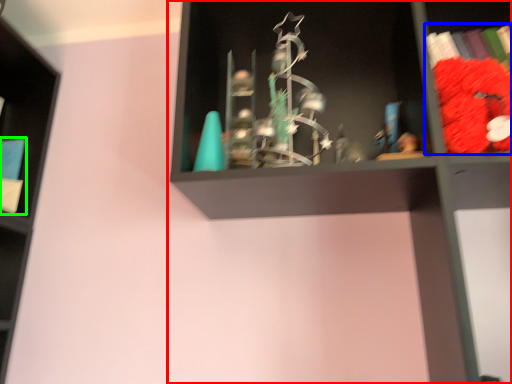
Question: Which is farther away from shelf (highlighted by a red box)? book (highlighted by a blue box) or book (highlighted by a green box)?

Choices:
 (A) book
 (B) book

Answer: (B)